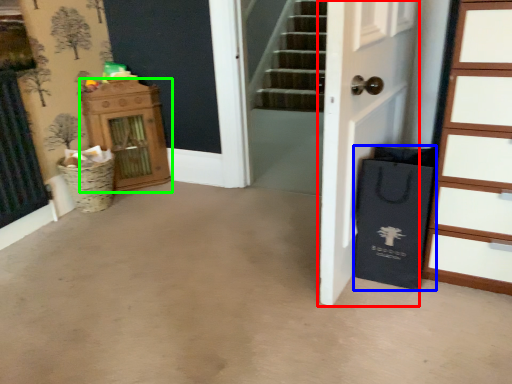
Question: Which object is positioned farthest from door (highlighted by a red box)? Select from shopping bag (highlighted by a blue box) and dresser (highlighted by a green box).

Choices:
 (A) shopping bag
 (B) dresser

Answer: (B)